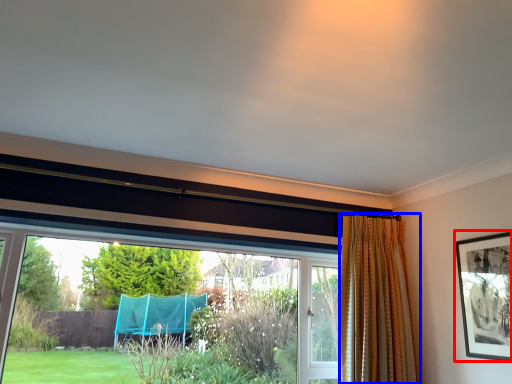
Question: Which of the following is the farthest to the observer, picture frame (highlighted by a red box) or curtain (highlighted by a blue box)?

Choices:
 (A) picture frame
 (B) curtain

Answer: (B)